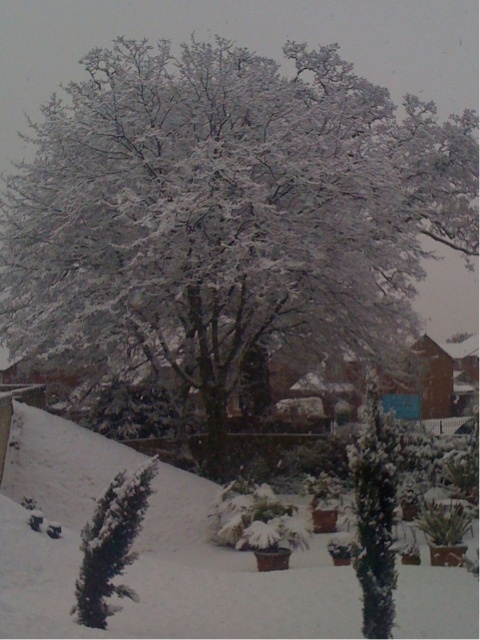
Is white fluffy snow at center wider than green matte evergreen tree at center?

Indeed, white fluffy snow at center has a greater width compared to green matte evergreen tree at center.

Does white fluffy snow at center appear over green matte evergreen tree at center?

Incorrect, white fluffy snow at center is not positioned above green matte evergreen tree at center.

Describe the element at coordinates (148, 552) in the screenshot. This screenshot has width=480, height=640. I see `white fluffy snow at center` at that location.

This screenshot has height=640, width=480. I want to click on white fluffy snow at center, so point(148,552).

Looking at this image, is white fluffy snow at center below green textured bush at lower left?

Yes.

Is point (158, 497) closer to viewer compared to point (121, 570)?

No, it is not.

I want to click on white fluffy snow at center, so click(148, 552).

Measure the distance from white frosty tree at upper center to green textured bush at lower left.

white frosty tree at upper center is 43.95 feet away from green textured bush at lower left.

You are a GUI agent. You are given a task and a screenshot of the screen. Output one action in this format:
    pyautogui.click(x=<x>, y=<y>)
    Task: Click on the white frosty tree at upper center
    The height and width of the screenshot is (640, 480).
    Given the screenshot: What is the action you would take?
    pyautogui.click(x=228, y=211)